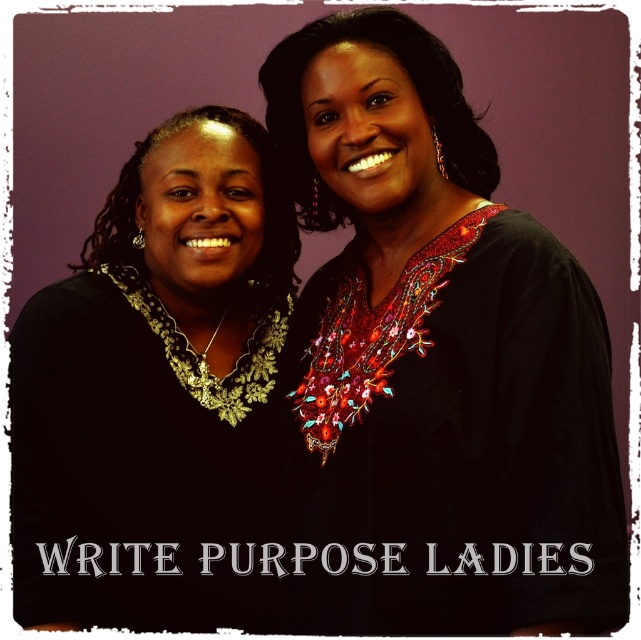
You are a photographer adjusting your camera to focus on two specific points in the image. The first point is point (178, 314) and the second is point (251, 275). Which point should you focus on first if you want to ensure the closest point is in sharp focus?

Point (178, 314) is closer to the camera than point (251, 275), so you should focus on point (178, 314) first to ensure the closest point is in sharp focus.

You are a photographer trying to focus on the black embroidered blouse at center and the matte black blouse at upper center in the image. Which blouse is closer to the camera?

The black embroidered blouse at center is closer to the camera than the matte black blouse at upper center because it is in front of it.